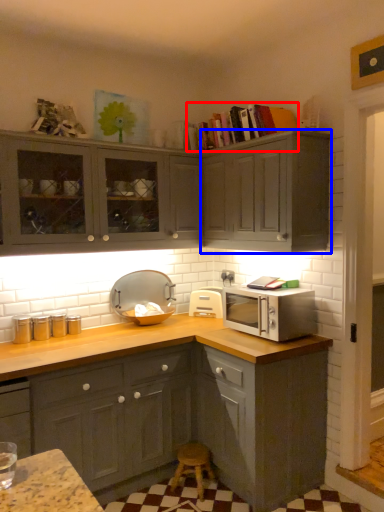
Question: Which object appears closest to the camera in this image, book (highlighted by a red box) or cabinetry (highlighted by a blue box)?

Choices:
 (A) book
 (B) cabinetry

Answer: (B)